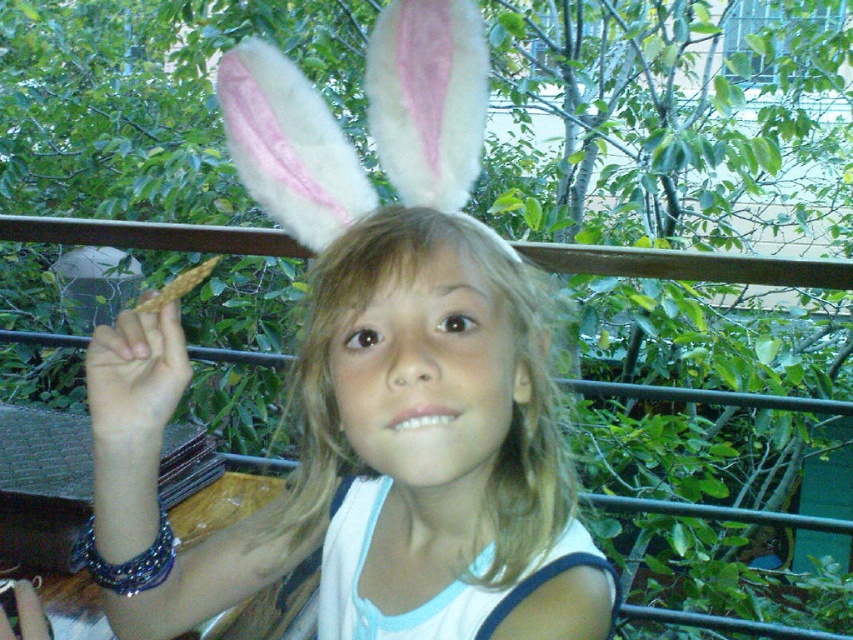
How much distance is there between white fluffy bunny ears at upper center and matte white head at center?

The distance of white fluffy bunny ears at upper center from matte white head at center is 5.02 centimeters.

Can you confirm if white fluffy bunny ears at upper center is thinner than matte white head at center?

No, white fluffy bunny ears at upper center is not thinner than matte white head at center.

Image resolution: width=853 pixels, height=640 pixels. What do you see at coordinates (367, 380) in the screenshot? I see `white fluffy bunny ears at upper center` at bounding box center [367, 380].

This screenshot has height=640, width=853. What are the coordinates of `white fluffy bunny ears at upper center` in the screenshot? It's located at (367, 380).